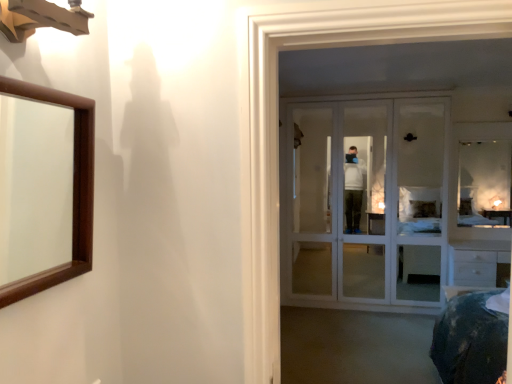
How much space does brown wooden mirror at left, which is counted as the first mirror, starting from the left, occupy vertically?

17.99 inches.

The width and height of the screenshot is (512, 384). Identify the location of clear glass mirror at upper right, the 2th mirror from the front. (485, 183).

Is brown wooden mirror at left, which is the first mirror in front-to-back order, located within clear glass mirror at upper right, the 1th mirror when ordered from right to left?

No, brown wooden mirror at left, which is the first mirror in front-to-back order, is not a part of clear glass mirror at upper right, the 1th mirror when ordered from right to left.

Find the location of `mirror that appears on the right of brown wooden mirror at left, which is counted as the first mirror, starting from the left`. mirror that appears on the right of brown wooden mirror at left, which is counted as the first mirror, starting from the left is located at coordinates (485, 183).

Is clear glass mirror at upper right, acting as the second mirror starting from the left, bigger or smaller than brown wooden mirror at left, which is the first mirror in front-to-back order?

In the image, clear glass mirror at upper right, acting as the second mirror starting from the left, appears to be larger than brown wooden mirror at left, which is the first mirror in front-to-back order.

Which is closer, [462,217] or [48,133]?

The point [48,133] is closer.

I want to click on mirror that appears on the right of brown wooden mirror at left, which is the first mirror in front-to-back order, so click(x=485, y=183).

Considering the sizes of objects brown wooden mirror at left, placed as the second mirror when sorted from right to left, and clear glass mirror at upper right, the 1th mirror when ordered from right to left, in the image provided, who is shorter, brown wooden mirror at left, placed as the second mirror when sorted from right to left, or clear glass mirror at upper right, the 1th mirror when ordered from right to left,?

brown wooden mirror at left, placed as the second mirror when sorted from right to left.

Can you confirm if brown wooden mirror at left, which is counted as the first mirror, starting from the left, is positioned to the left of clear glass mirror at upper right, the 2th mirror from the front?

Indeed, brown wooden mirror at left, which is counted as the first mirror, starting from the left, is positioned on the left side of clear glass mirror at upper right, the 2th mirror from the front.

Is brown wooden mirror at left, which is counted as the first mirror, starting from the left, in front of or behind white glass door at center in the image?

brown wooden mirror at left, which is counted as the first mirror, starting from the left, is in front of white glass door at center.

Is brown wooden mirror at left, placed as the second mirror when sorted from right to left, looking in the opposite direction of white glass door at center?

brown wooden mirror at left, placed as the second mirror when sorted from right to left, does not have its back to white glass door at center.

Is brown wooden mirror at left, which is the first mirror in front-to-back order, to the left or to the right of white glass door at center in the image?

Based on their positions, brown wooden mirror at left, which is the first mirror in front-to-back order, is located to the left of white glass door at center.

Could white glass door at center be considered to be inside brown wooden mirror at left, which is the first mirror in front-to-back order?

Actually, white glass door at center is outside brown wooden mirror at left, which is the first mirror in front-to-back order.

Is white glass door at center positioned behind clear glass mirror at upper right, which appears as the first mirror when viewed from the back?

That is False.

From a real-world perspective, which object stands above the other?

clear glass mirror at upper right, which appears as the first mirror when viewed from the back, is physically above.

Is white glass door at center wider or thinner than clear glass mirror at upper right, the 1th mirror when ordered from right to left?

white glass door at center is wider than clear glass mirror at upper right, the 1th mirror when ordered from right to left.

Identify the location of door lying behind the brown wooden mirror at left, the 2th mirror from the back. Image resolution: width=512 pixels, height=384 pixels. point(364,204).

Is white glass door at center taller than brown wooden mirror at left, placed as the second mirror when sorted from right to left?

Yes.

Who is smaller, white glass door at center or brown wooden mirror at left, which is counted as the first mirror, starting from the left?

brown wooden mirror at left, which is counted as the first mirror, starting from the left, is smaller.

In the scene shown: How distant is clear glass mirror at upper right, the 1th mirror when ordered from right to left, from white glass door at center?

They are 87.96 centimeters apart.

Image resolution: width=512 pixels, height=384 pixels. I want to click on the 1st mirror above the white glass door at center (from a real-world perspective), so click(485, 183).

Considering the relative sizes of clear glass mirror at upper right, acting as the second mirror starting from the left, and white glass door at center in the image provided, is clear glass mirror at upper right, acting as the second mirror starting from the left, shorter than white glass door at center?

Indeed, clear glass mirror at upper right, acting as the second mirror starting from the left, has a lesser height compared to white glass door at center.

Which is more to the left, clear glass mirror at upper right, the 1th mirror when ordered from right to left, or white glass door at center?

Positioned to the left is white glass door at center.

The width and height of the screenshot is (512, 384). I want to click on mirror above the brown wooden mirror at left, which is counted as the first mirror, starting from the left (from the image's perspective), so click(485, 183).

This screenshot has width=512, height=384. Identify the location of mirror on the left of the clear glass mirror at upper right, the 2th mirror from the front. (35, 187).

From the image, which object appears to be farther from brown wooden mirror at left, which is counted as the first mirror, starting from the left, white glass door at center or clear glass mirror at upper right, the 1th mirror when ordered from right to left?

Among the two, clear glass mirror at upper right, the 1th mirror when ordered from right to left, is located further to brown wooden mirror at left, which is counted as the first mirror, starting from the left.

Looking at this image, estimate the real-world distances between objects in this image. Which object is closer to white glass door at center, brown wooden mirror at left, the 2th mirror from the back, or clear glass mirror at upper right, the 1th mirror when ordered from right to left?

Based on the image, clear glass mirror at upper right, the 1th mirror when ordered from right to left, appears to be nearer to white glass door at center.

Estimate the real-world distances between objects in this image. Which object is closer to clear glass mirror at upper right, the 2th mirror from the front, white glass door at center or brown wooden mirror at left, placed as the second mirror when sorted from right to left?

Among the two, white glass door at center is located nearer to clear glass mirror at upper right, the 2th mirror from the front.

Based on their spatial positions, is brown wooden mirror at left, which is counted as the first mirror, starting from the left, or white glass door at center closer to clear glass mirror at upper right, the 2th mirror from the front?

white glass door at center is positioned closer to the anchor clear glass mirror at upper right, the 2th mirror from the front.

Considering their positions, is clear glass mirror at upper right, the 1th mirror when ordered from right to left, positioned closer to white glass door at center than brown wooden mirror at left, which is counted as the first mirror, starting from the left?

Among the two, clear glass mirror at upper right, the 1th mirror when ordered from right to left, is located nearer to white glass door at center.

When comparing their distances from brown wooden mirror at left, which is counted as the first mirror, starting from the left, does clear glass mirror at upper right, acting as the second mirror starting from the left, or white glass door at center seem closer?

white glass door at center lies closer to brown wooden mirror at left, which is counted as the first mirror, starting from the left, than the other object.

Image resolution: width=512 pixels, height=384 pixels. I want to click on door between brown wooden mirror at left, which is counted as the first mirror, starting from the left, and clear glass mirror at upper right, acting as the second mirror starting from the left, from front to back, so click(x=364, y=204).